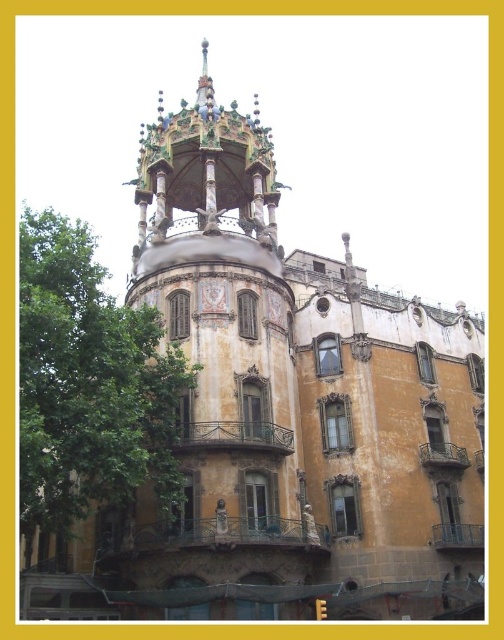
Question: Which point is farther to the camera?

Choices:
 (A) (241, 438)
 (B) (33, 401)

Answer: (A)

Question: Does yellowish textured building at center appear under green leafy tree at left?

Choices:
 (A) no
 (B) yes

Answer: (A)

Question: Can you confirm if yellowish textured building at center is positioned below green leafy tree at left?

Choices:
 (A) yes
 (B) no

Answer: (B)

Question: Which of the following is the farthest from the observer?

Choices:
 (A) (175, 429)
 (B) (281, 547)

Answer: (A)

Question: Does yellowish textured building at center have a greater width compared to green leafy tree at left?

Choices:
 (A) no
 (B) yes

Answer: (A)